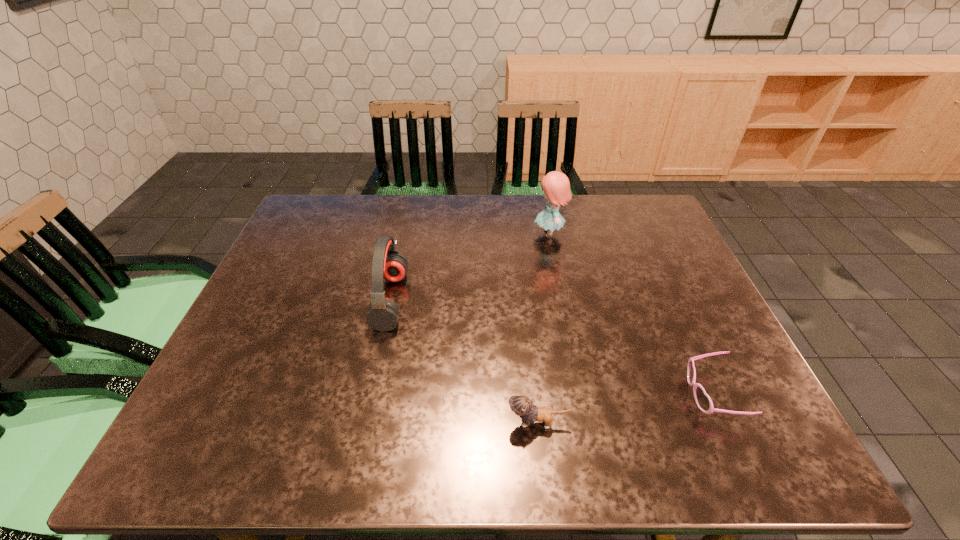
Locate an element on the screen. vacant space located on the front-facing side of the third tallest object is located at coordinates point(402,423).

I want to click on free spot located on the front-facing side of the third tallest object, so click(x=337, y=423).

In order to click on free space located 0.210m on the front-facing side of the third tallest object in this screenshot , I will do `click(402, 423)`.

Locate an element on the screen. vacant region located on the front-facing side of the shortest object is located at coordinates click(x=663, y=394).

Locate an element on the screen. free space located 0.060m on the front-facing side of the shortest object is located at coordinates (660, 394).

The image size is (960, 540). In order to click on free space located 0.180m on the front-facing side of the shortest object in this screenshot , I will do `click(602, 394)`.

Identify the location of object that is at the far edge. (556, 185).

Where is `kitten that is at the near edge`? kitten that is at the near edge is located at coordinates (522, 406).

The height and width of the screenshot is (540, 960). What are the coordinates of `sunglasses that is at the near edge` in the screenshot? It's located at (703, 401).

At what (x,y) coordinates should I click in order to perform the action: click on object situated at the right edge. Please return your answer as a coordinate pair (x, y). The height and width of the screenshot is (540, 960). Looking at the image, I should click on (703, 401).